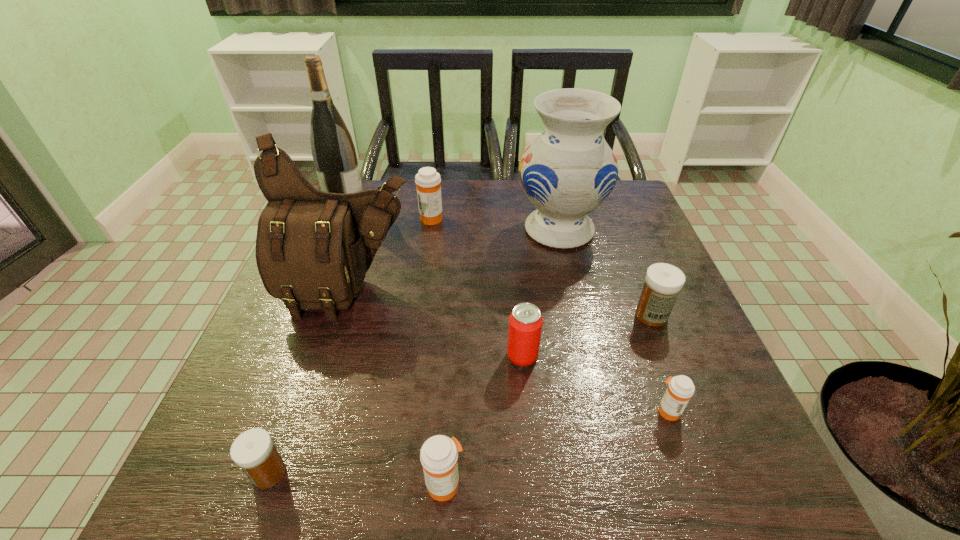
Select which object is the sixth closest to the wine bottle. Please provide its 2D coordinates. Your answer should be formatted as a tuple, i.e. [(x, y)], where the tuple contains the x and y coordinates of a point satisfying the conditions above.

[(663, 282)]

Choose which medicine is the nearest neighbor to the fourth nearest medicine. Please provide its 2D coordinates. Your answer should be formatted as a tuple, i.e. [(x, y)], where the tuple contains the x and y coordinates of a point satisfying the conditions above.

[(680, 389)]

Where is `medicine that is the second closest to the leftmost medicine`? Image resolution: width=960 pixels, height=540 pixels. medicine that is the second closest to the leftmost medicine is located at coordinates (680, 389).

Where is `orange medicine that is the second closest to the shoulder bag`? orange medicine that is the second closest to the shoulder bag is located at coordinates (439, 454).

Locate which orange medicine ranks in proximity to the brown wine bottle. Please provide its 2D coordinates. Your answer should be formatted as a tuple, i.e. [(x, y)], where the tuple contains the x and y coordinates of a point satisfying the conditions above.

[(428, 181)]

At what (x,y) coordinates should I click in order to perform the action: click on vacant position in the image that satisfies the following two spatial constraints: 1. on the label of the vase; 2. on the left side of the wine bottle. Please return your answer as a coordinate pair (x, y). This screenshot has width=960, height=540. Looking at the image, I should click on (334, 230).

At what (x,y) coordinates should I click in order to perform the action: click on vacant region that satisfies the following two spatial constraints: 1. on the back side of the third nearest object; 2. on the left side of the smaller white medicine. Please return your answer as a coordinate pair (x, y). This screenshot has width=960, height=540. Looking at the image, I should click on (291, 410).

Find the location of a particular element. The height and width of the screenshot is (540, 960). free spot that satisfies the following two spatial constraints: 1. on the back side of the leftmost medicine; 2. on the left side of the fourth tallest object is located at coordinates (360, 218).

At what (x,y) coordinates should I click in order to perform the action: click on free spot that satisfies the following two spatial constraints: 1. on the back side of the right white medicine; 2. on the right side of the smaller white medicine. Please return your answer as a coordinate pair (x, y). This screenshot has height=540, width=960. Looking at the image, I should click on tap(324, 315).

Where is `vacant region that satisfies the following two spatial constraints: 1. on the label of the brown wine bottle; 2. on the right side of the farther white medicine`? vacant region that satisfies the following two spatial constraints: 1. on the label of the brown wine bottle; 2. on the right side of the farther white medicine is located at coordinates (299, 315).